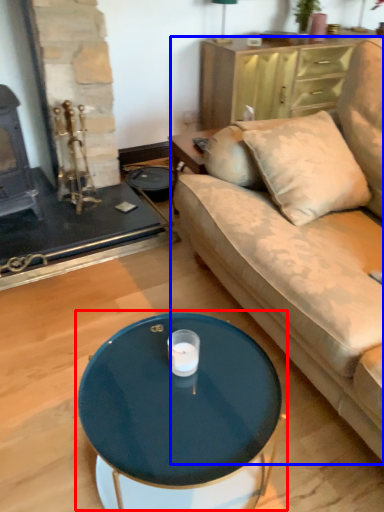
Question: Among these objects, which one is farthest to the camera, coffee table (highlighted by a red box) or studio couch (highlighted by a blue box)?

Choices:
 (A) coffee table
 (B) studio couch

Answer: (A)